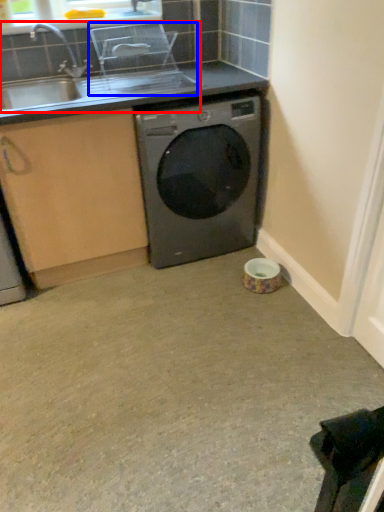
Question: Which point is closer to the camera, sink (highlighted by a red box) or appliance (highlighted by a blue box)?

Choices:
 (A) sink
 (B) appliance

Answer: (A)